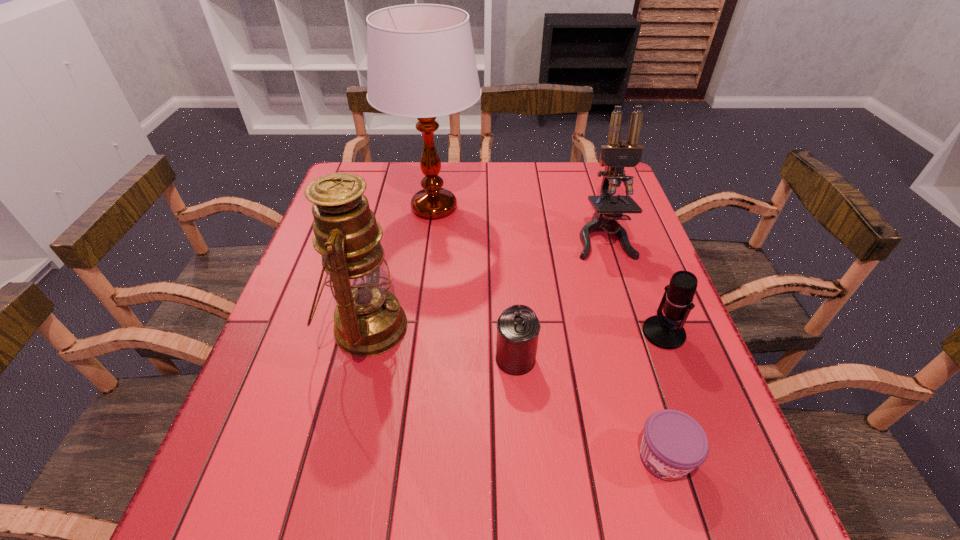
The width and height of the screenshot is (960, 540). In order to click on object located at the near right corner in this screenshot , I will do `click(673, 444)`.

Locate an element on the screen. Image resolution: width=960 pixels, height=540 pixels. vacant space at the far edge of the desktop is located at coordinates (560, 171).

In the image, there is a desktop. Where is `free region at the near edge`? The image size is (960, 540). free region at the near edge is located at coordinates (314, 512).

The image size is (960, 540). Find the location of `vacant space at the left edge of the desktop`. vacant space at the left edge of the desktop is located at coordinates pos(310,461).

In the image, there is a desktop. Where is `free space at the right edge`? The width and height of the screenshot is (960, 540). free space at the right edge is located at coordinates [x=623, y=315].

Locate an element on the screen. The image size is (960, 540). vacant area between the shortest object and the microscope is located at coordinates (634, 348).

Where is `unoccupied position between the tallest object and the microscope`? unoccupied position between the tallest object and the microscope is located at coordinates (518, 222).

The width and height of the screenshot is (960, 540). Identify the location of vacant space in between the table lamp and the microscope. pos(518,222).

Locate an element on the screen. This screenshot has width=960, height=540. free space between the microscope and the shortest object is located at coordinates (634, 348).

Identify the location of free space that is in between the fifth tallest object and the jam. The image size is (960, 540). (589, 408).